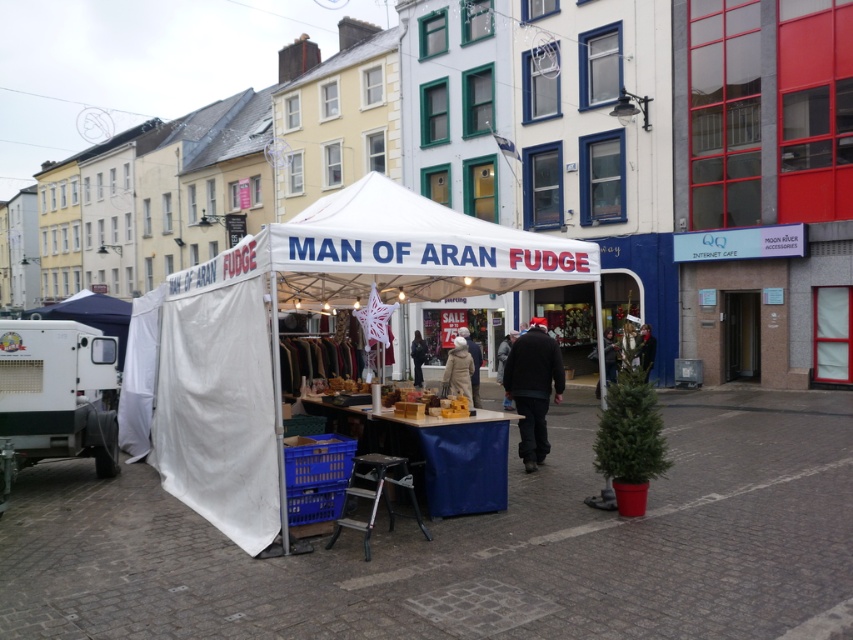
You are standing at the entrance of the street and want to locate the white fabric tent at center. According to the coordinates provided, where should you look relative to the buildings in the background?

The white fabric tent at center is located at coordinates point (x=308, y=307), which places it near the center of the image, between the buildings in the background.

You are a customer at the market stall and want to know which structure is wider between the white fabric tent at center and the white fabric canopy at center. Can you determine which one is wider?

The white fabric tent at center is wider than the white fabric canopy at center.

You are a customer standing in front of the market stall. You see the white fabric tent at center and the dark blue jacket at center. Which item is located to the right of the other?

The white fabric tent at center is positioned on the right side of dark blue jacket at center, so the white fabric tent at center is to the right of the dark blue jacket at center.